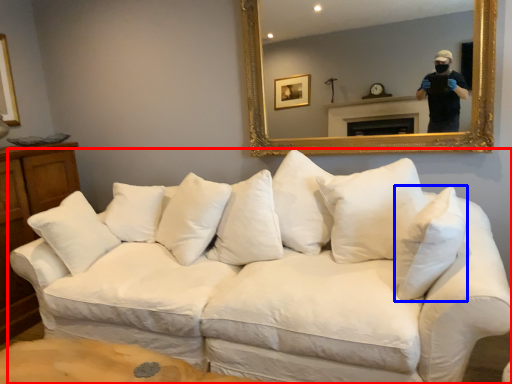
Question: Which of the following is the farthest to the observer, studio couch (highlighted by a red box) or pillow (highlighted by a blue box)?

Choices:
 (A) studio couch
 (B) pillow

Answer: (B)